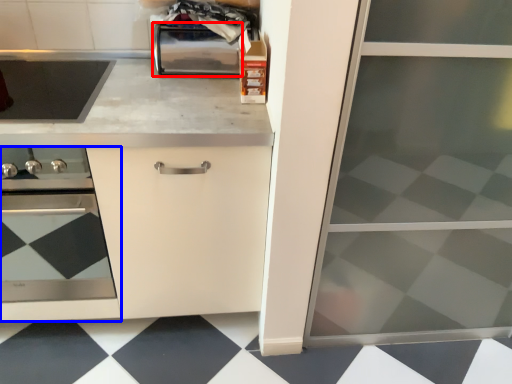
Question: Which point is further to the camera, toaster (highlighted by a red box) or home appliance (highlighted by a blue box)?

Choices:
 (A) toaster
 (B) home appliance

Answer: (A)